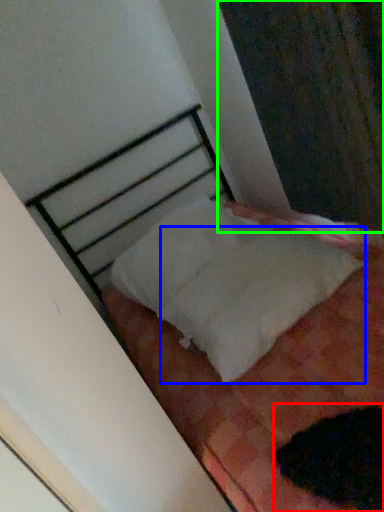
Question: Considering the real-world distances, which object is closest to animal (highlighted by a red box)? sheet (highlighted by a blue box) or curtain (highlighted by a green box).

Choices:
 (A) sheet
 (B) curtain

Answer: (A)